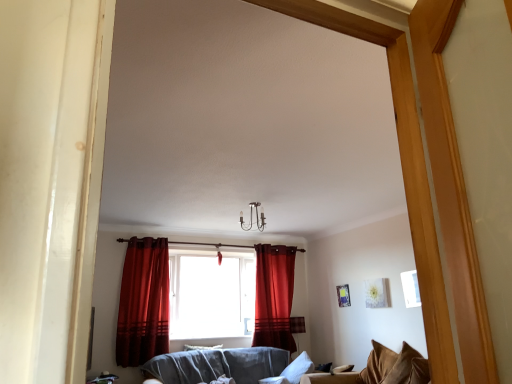
What do you see at coordinates (218, 365) in the screenshot? Image resolution: width=512 pixels, height=384 pixels. I see `velvet gray couch at center` at bounding box center [218, 365].

What do you see at coordinates (143, 302) in the screenshot?
I see `velvet red curtain at center, arranged as the 1th curtain when viewed from the front` at bounding box center [143, 302].

Describe the element at coordinates (381, 369) in the screenshot. This screenshot has width=512, height=384. I see `velvet brown couch at lower right` at that location.

Describe the element at coordinates (274, 296) in the screenshot. This screenshot has height=384, width=512. I see `velvet red curtain at center, which is counted as the 2th curtain, starting from the front` at that location.

The height and width of the screenshot is (384, 512). What do you see at coordinates (409, 368) in the screenshot?
I see `velvet brown pillow at lower right, which is the 1th pillow from top to bottom` at bounding box center [409, 368].

You are a GUI agent. You are given a task and a screenshot of the screen. Output one action in this format:
    pyautogui.click(x=<x>, y=<y>)
    Task: Click on the velvet gray couch at center
    
    Given the screenshot: What is the action you would take?
    pyautogui.click(x=218, y=365)

Would you say translucent fabric curtain at center is a long distance from velvet brown pillow at lower right, the 2th pillow ordered from the bottom?

translucent fabric curtain at center is far away from velvet brown pillow at lower right, the 2th pillow ordered from the bottom.

From the image's perspective, which one is positioned lower, translucent fabric curtain at center or velvet brown pillow at lower right, arranged as the 2th pillow when viewed from the back?

From the image's view, velvet brown pillow at lower right, arranged as the 2th pillow when viewed from the back, is below.

Considering the positions of point (195, 305) and point (389, 377), is point (195, 305) closer or farther from the camera than point (389, 377)?

Clearly, point (195, 305) is more distant from the camera than point (389, 377).

Which object is positioned more to the left, translucent fabric curtain at center or velvet brown pillow at lower right, the 2th pillow ordered from the bottom?

Positioned to the left is translucent fabric curtain at center.

Is velvet red curtain at center, the first curtain when ordered from back to front, positioned with its back to velvet gray couch at center?

velvet red curtain at center, the first curtain when ordered from back to front, does not have its back to velvet gray couch at center.

Considering the relative positions of velvet red curtain at center, the first curtain when ordered from back to front, and velvet gray couch at center in the image provided, is velvet red curtain at center, the first curtain when ordered from back to front, to the left of velvet gray couch at center from the viewer's perspective?

No, velvet red curtain at center, the first curtain when ordered from back to front, is not to the left of velvet gray couch at center.

Considering the relative sizes of velvet brown couch at lower right and velvet red curtain at center, which is the 2th curtain in left-to-right order, in the image provided, is velvet brown couch at lower right shorter than velvet red curtain at center, which is the 2th curtain in left-to-right order,?

Correct, velvet brown couch at lower right is not as tall as velvet red curtain at center, which is the 2th curtain in left-to-right order.

Looking at this image, considering the sizes of objects velvet brown couch at lower right and velvet red curtain at center, which is the 2th curtain in left-to-right order, in the image provided, who is smaller, velvet brown couch at lower right or velvet red curtain at center, which is the 2th curtain in left-to-right order,?

Smaller between the two is velvet red curtain at center, which is the 2th curtain in left-to-right order.

Is point (386, 365) positioned before point (257, 255)?

Yes, it is in front of point (257, 255).

From the image's perspective, relative to velvet brown pillow at lower right, the 2th pillow positioned from the left, is velvet brown couch at lower right above or below?

Based on their image positions, velvet brown couch at lower right is located beneath velvet brown pillow at lower right, the 2th pillow positioned from the left.

From a real-world perspective, between velvet brown couch at lower right and velvet brown pillow at lower right, the 2th pillow positioned from the left, who is vertically lower?

In real-world perspective, velvet brown pillow at lower right, the 2th pillow positioned from the left, is lower.

Considering the relative sizes of velvet brown couch at lower right and velvet brown pillow at lower right, the 2th pillow ordered from the bottom, in the image provided, is velvet brown couch at lower right taller than velvet brown pillow at lower right, the 2th pillow ordered from the bottom,?

Indeed, velvet brown couch at lower right has a greater height compared to velvet brown pillow at lower right, the 2th pillow ordered from the bottom.

Who is smaller, translucent fabric curtain at center or velvet brown couch at lower right?

velvet brown couch at lower right is smaller.

Is translucent fabric curtain at center inside or outside of velvet brown couch at lower right?

translucent fabric curtain at center is outside velvet brown couch at lower right.

From a real-world perspective, is translucent fabric curtain at center physically above velvet brown couch at lower right?

Indeed, from a real-world perspective, translucent fabric curtain at center stands above velvet brown couch at lower right.

Can you confirm if translucent fabric curtain at center is shorter than velvet brown couch at lower right?

No.

Considering the positions of objects velvet red curtain at center, the first curtain when ordered from back to front, and white soft pillow at lower center, marked as the 1th pillow in a left-to-right arrangement, in the image provided, who is more to the right, velvet red curtain at center, the first curtain when ordered from back to front, or white soft pillow at lower center, marked as the 1th pillow in a left-to-right arrangement,?

From the viewer's perspective, velvet red curtain at center, the first curtain when ordered from back to front, appears more on the right side.

From the picture: Is velvet red curtain at center, which appears as the first curtain when viewed from the right, completely or partially outside of white soft pillow at lower center, arranged as the first pillow when viewed from the back?

Indeed, velvet red curtain at center, which appears as the first curtain when viewed from the right, is completely outside white soft pillow at lower center, arranged as the first pillow when viewed from the back.

Where is `curtain behind the white soft pillow at lower center, positioned as the 2th pillow in right-to-left order`? curtain behind the white soft pillow at lower center, positioned as the 2th pillow in right-to-left order is located at coordinates (274, 296).

From the image's perspective, who appears lower, velvet red curtain at center, the first curtain when ordered from back to front, or white soft pillow at lower center, which is the 2th pillow in front-to-back order?

white soft pillow at lower center, which is the 2th pillow in front-to-back order, appears lower in the image.

From the image's perspective, would you say velvet brown pillow at lower right, acting as the 1th pillow starting from the right, is shown under translucent fabric curtain at center?

Correct, velvet brown pillow at lower right, acting as the 1th pillow starting from the right, appears lower than translucent fabric curtain at center in the image.

Does velvet brown pillow at lower right, which is the 1th pillow from top to bottom, turn towards translucent fabric curtain at center?

No, velvet brown pillow at lower right, which is the 1th pillow from top to bottom, does not turn towards translucent fabric curtain at center.

Considering the relative sizes of velvet brown pillow at lower right, arranged as the 2th pillow when viewed from the back, and translucent fabric curtain at center in the image provided, is velvet brown pillow at lower right, arranged as the 2th pillow when viewed from the back, wider than translucent fabric curtain at center?

Correct, the width of velvet brown pillow at lower right, arranged as the 2th pillow when viewed from the back, exceeds that of translucent fabric curtain at center.

How distant is velvet brown pillow at lower right, which ranks as the first pillow in front-to-back order, from translucent fabric curtain at center?

They are 8.01 feet apart.

From the translucent fabric curtain at center, count 2nd pillows forward and point to it. Please provide its 2D coordinates.

[(409, 368)]

From a real-world perspective, which curtain is the 2nd one above the velvet gray couch at center? Please provide its 2D coordinates.

[(274, 296)]

Estimate the real-world distances between objects in this image. Which object is further from velvet brown pillow at lower right, arranged as the 2th pillow when viewed from the back, white soft pillow at lower center, arranged as the first pillow when viewed from the back, or translucent fabric curtain at center?

The object further to velvet brown pillow at lower right, arranged as the 2th pillow when viewed from the back, is white soft pillow at lower center, arranged as the first pillow when viewed from the back.

Based on their spatial positions, is velvet brown couch at lower right or velvet red curtain at center, the second curtain when ordered from back to front, further from white soft pillow at lower center, marked as the 2th pillow in a top-to-bottom arrangement?

velvet brown couch at lower right is further to white soft pillow at lower center, marked as the 2th pillow in a top-to-bottom arrangement.

When comparing their distances from velvet brown couch at lower right, does velvet red curtain at center, arranged as the 1th curtain when viewed from the front, or velvet brown pillow at lower right, arranged as the 2th pillow when viewed from the back, seem further?

velvet red curtain at center, arranged as the 1th curtain when viewed from the front, lies further to velvet brown couch at lower right than the other object.

Based on their spatial positions, is velvet red curtain at center, arranged as the 1th curtain when viewed from the front, or velvet gray couch at center closer to translucent fabric curtain at center?

velvet gray couch at center is positioned closer to the anchor translucent fabric curtain at center.

Estimate the real-world distances between objects in this image. Which object is closer to velvet brown couch at lower right, white soft pillow at lower center, the first pillow ordered from the bottom, or velvet red curtain at center, marked as the 2th curtain in a right-to-left arrangement?

Among the two, white soft pillow at lower center, the first pillow ordered from the bottom, is located nearer to velvet brown couch at lower right.

Looking at the image, which one is located closer to velvet red curtain at center, the first curtain viewed from the left, velvet brown couch at lower right or velvet brown pillow at lower right, which is the 1th pillow from top to bottom?

velvet brown couch at lower right is closer to velvet red curtain at center, the first curtain viewed from the left.

Looking at the image, which one is located further to velvet brown pillow at lower right, the 2th pillow positioned from the left, velvet gray couch at center or velvet brown couch at lower right?

velvet gray couch at center is positioned further to the anchor velvet brown pillow at lower right, the 2th pillow positioned from the left.

Looking at the image, which one is located closer to velvet brown couch at lower right, white soft pillow at lower center, positioned as the 2th pillow in right-to-left order, or velvet red curtain at center, which is counted as the 2th curtain, starting from the front?

velvet red curtain at center, which is counted as the 2th curtain, starting from the front.

At what (x,y) coordinates should I click in order to perform the action: click on studio couch between white soft pillow at lower center, marked as the 2th pillow in a top-to-bottom arrangement, and velvet brown pillow at lower right, which is the 1th pillow from top to bottom. Please return your answer as a coordinate pair (x, y). The image size is (512, 384). Looking at the image, I should click on (218, 365).

Where is `studio couch between translucent fabric curtain at center and velvet brown couch at lower right from left to right`? The image size is (512, 384). studio couch between translucent fabric curtain at center and velvet brown couch at lower right from left to right is located at coordinates (218, 365).

Identify the location of studio couch between translucent fabric curtain at center and velvet brown pillow at lower right, acting as the 1th pillow starting from the right, in the horizontal direction. (218, 365).

In order to click on curtain between velvet red curtain at center, arranged as the 1th curtain when viewed from the front, and velvet brown pillow at lower right, arranged as the 2th pillow when viewed from the back, from left to right in this screenshot , I will do `click(274, 296)`.